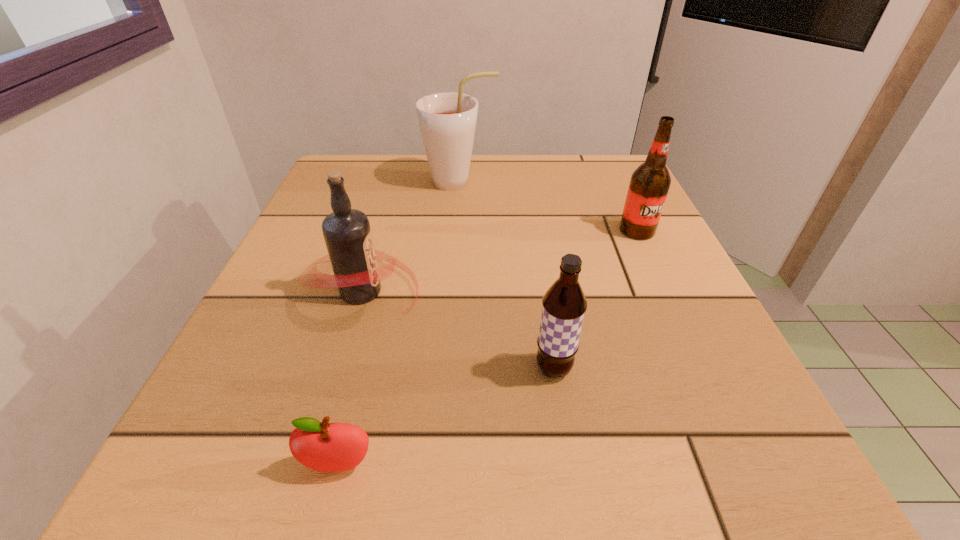
Locate an element on the screen. Image resolution: width=960 pixels, height=540 pixels. free space located 0.140m on the label of the third nearest object is located at coordinates (504, 291).

At what (x,y) coordinates should I click in order to perform the action: click on vacant space located on the left of the third root beer from left to right. Please return your answer as a coordinate pair (x, y). The width and height of the screenshot is (960, 540). Looking at the image, I should click on (419, 369).

The height and width of the screenshot is (540, 960). In order to click on vacant space located 0.230m on the back of the shortest object in this screenshot , I will do `click(376, 313)`.

At what (x,y) coordinates should I click in order to perform the action: click on object that is at the far edge. Please return your answer as a coordinate pair (x, y). Image resolution: width=960 pixels, height=540 pixels. Looking at the image, I should click on (447, 120).

At what (x,y) coordinates should I click in order to perform the action: click on object at the near edge. Please return your answer as a coordinate pair (x, y). Looking at the image, I should click on (329, 447).

The height and width of the screenshot is (540, 960). I want to click on root beer that is positioned at the left edge, so click(x=347, y=233).

You are a GUI agent. You are given a task and a screenshot of the screen. Output one action in this format:
    pyautogui.click(x=<x>, y=<y>)
    Task: Click on the apple present at the left edge
    
    Given the screenshot: What is the action you would take?
    pyautogui.click(x=329, y=447)

At what (x,y) coordinates should I click in order to perform the action: click on object that is at the right edge. Please return your answer as a coordinate pair (x, y). Looking at the image, I should click on (649, 185).

Where is `object present at the near left corner`? object present at the near left corner is located at coordinates (329, 447).

Where is `vacant space at the far edge of the desktop`? vacant space at the far edge of the desktop is located at coordinates [x=502, y=179].